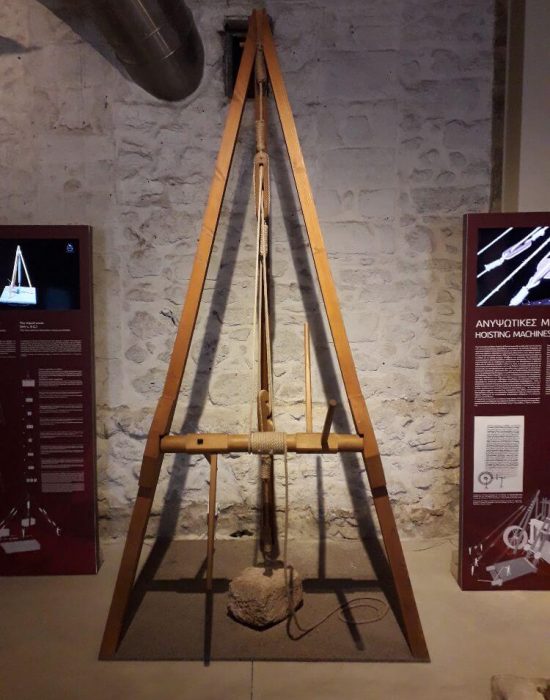
Locate an element on the screen. The image size is (550, 700). wall is located at coordinates (419, 238).